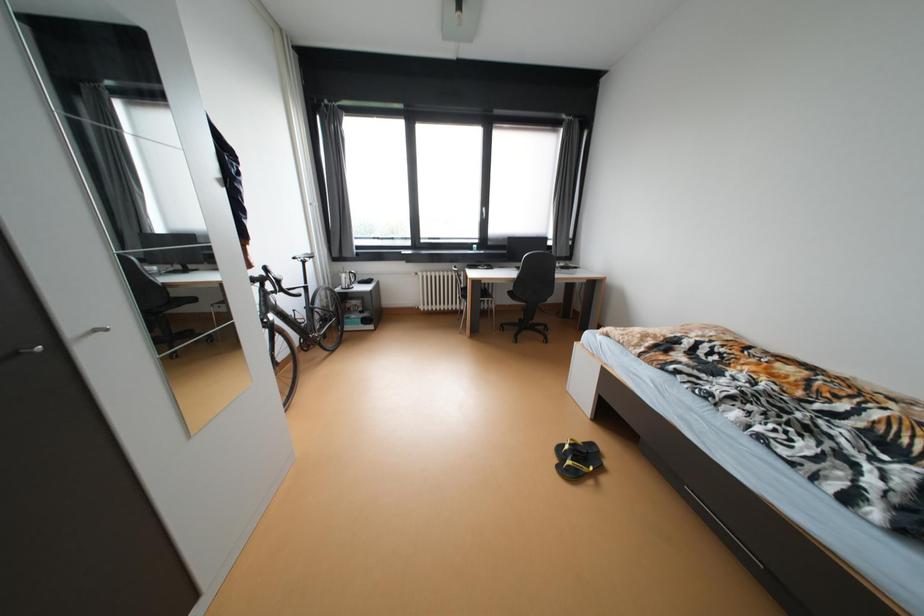
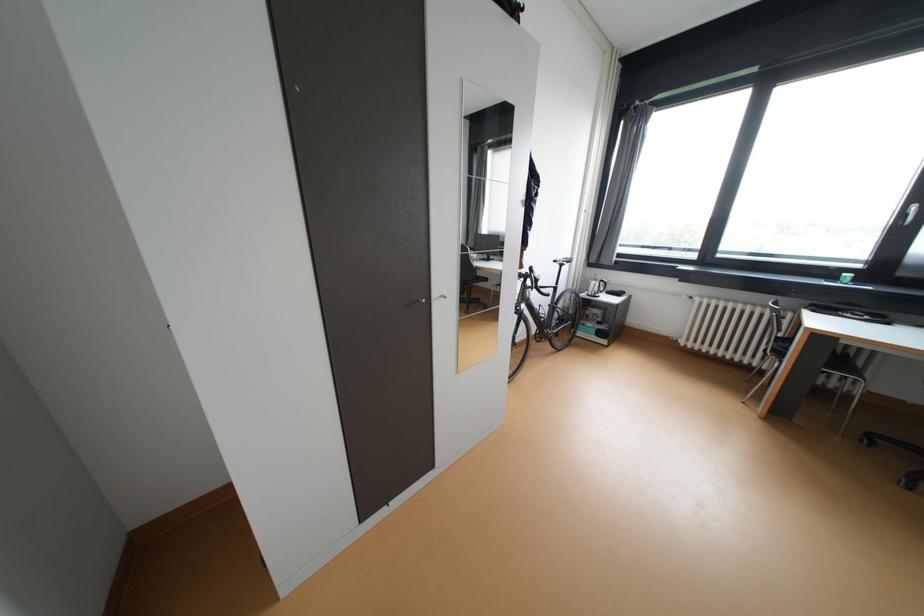
Question: The camera is either moving clockwise (left) or counter-clockwise (right) around the object. The first image is from the beginning of the video and the second image is from the end. Is the camera moving left or right when shooting the video?

Choices:
 (A) Left
 (B) Right

Answer: (B)